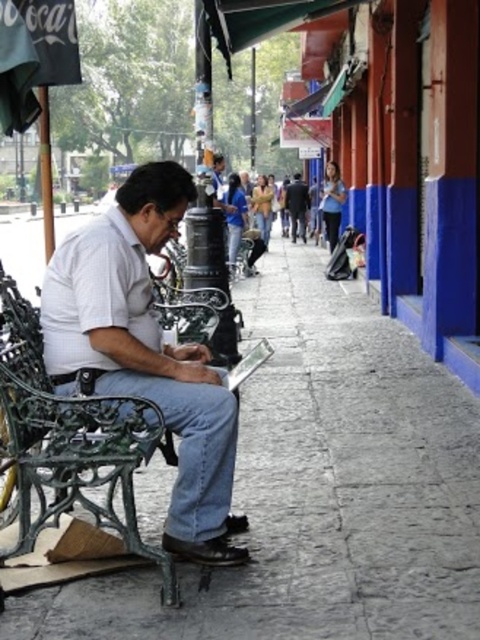
Is gray stone pavement at lower center behind white cotton shirt at center?

No, gray stone pavement at lower center is in front of white cotton shirt at center.

Where is `gray stone pavement at lower center`? gray stone pavement at lower center is located at coordinates (320, 488).

The image size is (480, 640). What do you see at coordinates (72, 440) in the screenshot? I see `green wrought iron bench at left` at bounding box center [72, 440].

Which is above, green wrought iron bench at left or dark blue jacket at center?

dark blue jacket at center is above.

Image resolution: width=480 pixels, height=640 pixels. What are the coordinates of `green wrought iron bench at left` in the screenshot? It's located at (72, 440).

The image size is (480, 640). What are the coordinates of `green wrought iron bench at left` in the screenshot? It's located at (72, 440).

This screenshot has height=640, width=480. Describe the element at coordinates (320, 488) in the screenshot. I see `gray stone pavement at lower center` at that location.

Who is higher up, gray stone pavement at lower center or dark blue jacket at center?

dark blue jacket at center

Who is more forward, (x=116, y=618) or (x=304, y=216)?

Point (x=116, y=618) is more forward.

Locate an element on the screen. This screenshot has width=480, height=640. gray stone pavement at lower center is located at coordinates (320, 488).